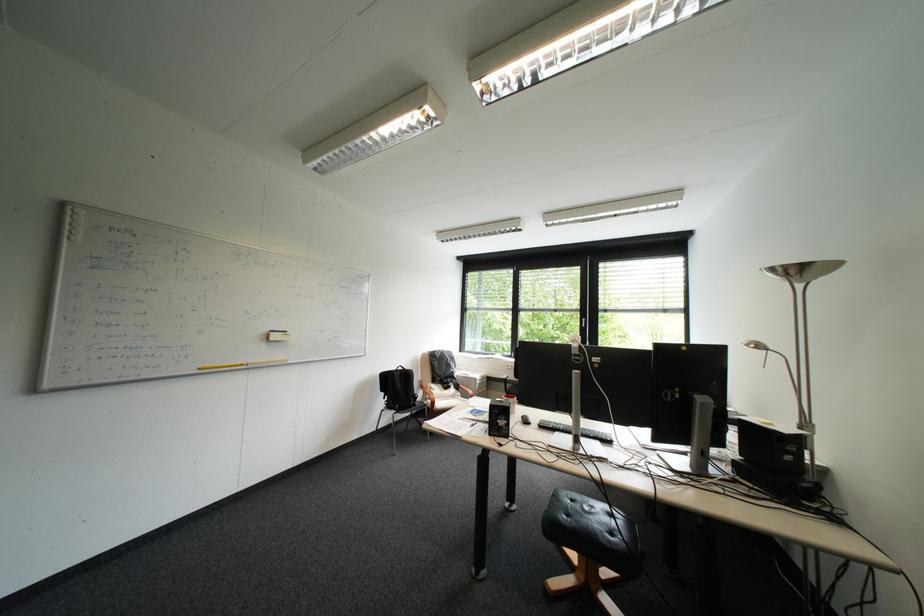
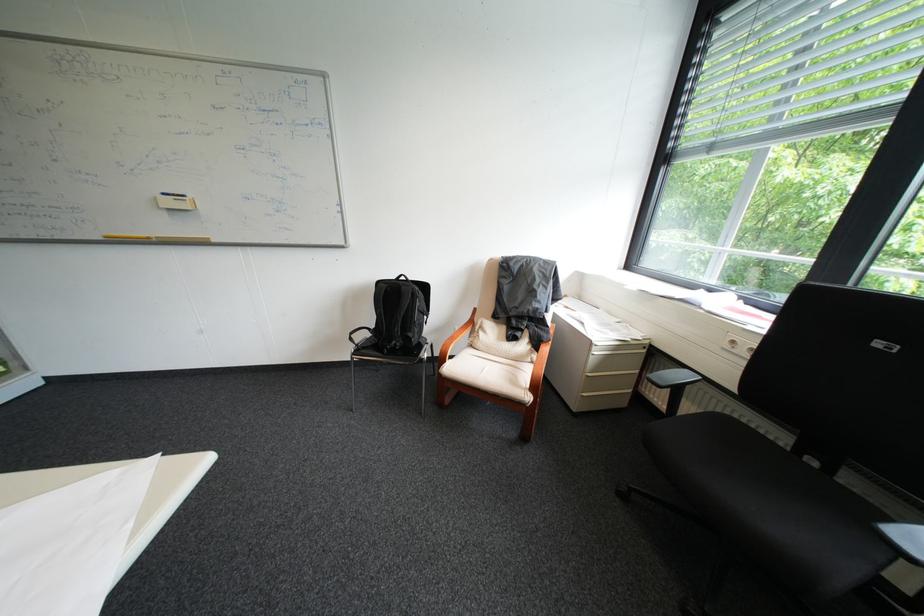
Find the pixel in the second image that matches pixel 284 331 in the first image.

(176, 195)